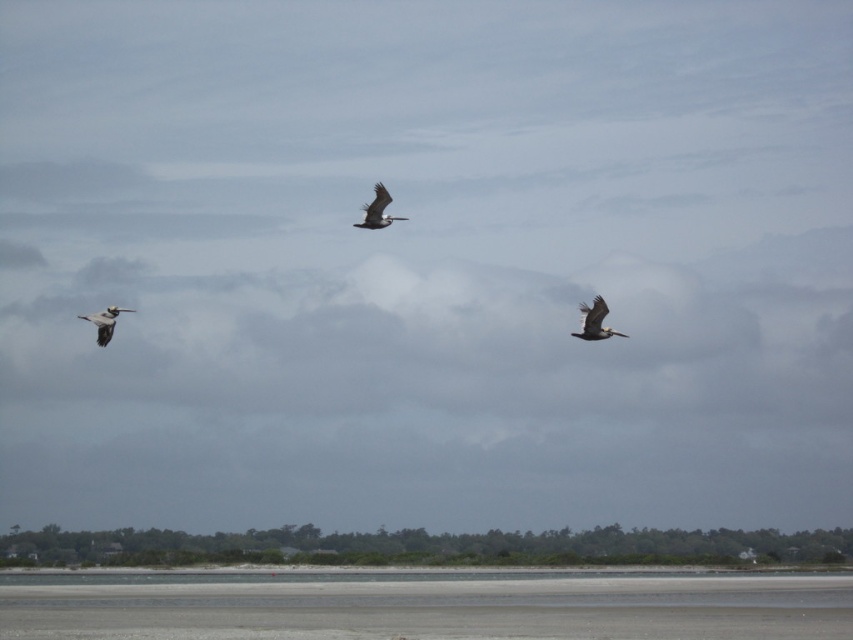
Question: Is brown feathered pelican at right to the right of brown feathered pelican at center from the viewer's perspective?

Choices:
 (A) yes
 (B) no

Answer: (A)

Question: Can you confirm if brown feathered pelican at center is positioned above gray feathered pelican at left?

Choices:
 (A) no
 (B) yes

Answer: (B)

Question: Which object is closer to the camera taking this photo?

Choices:
 (A) brown feathered pelican at center
 (B) brown feathered pelican at right
 (C) gray feathered pelican at left

Answer: (C)

Question: In this image, where is brown feathered pelican at right located relative to brown feathered pelican at center?

Choices:
 (A) left
 (B) right

Answer: (B)

Question: Which is farther from the brown feathered pelican at center?

Choices:
 (A) gray feathered pelican at left
 (B) brown feathered pelican at right

Answer: (A)

Question: Among these points, which one is nearest to the camera?

Choices:
 (A) (105, 328)
 (B) (372, 228)
 (C) (604, 337)

Answer: (A)